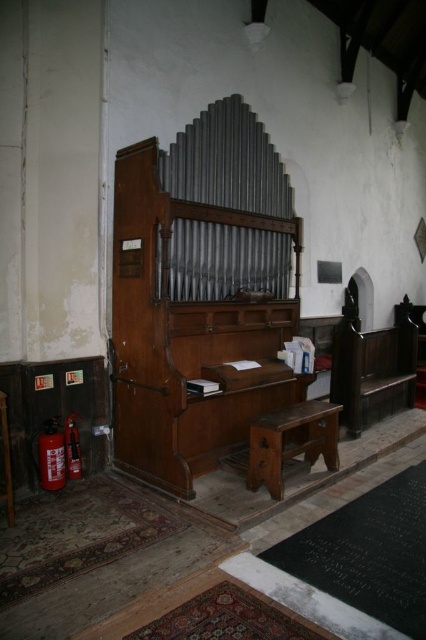
Looking at this image, which of these two, brown wooden bench at center or red matte extinguisher at lower left, stands taller?

Standing taller between the two is brown wooden bench at center.

Who is positioned more to the left, brown wooden bench at center or red matte extinguisher at lower left?

From the viewer's perspective, red matte extinguisher at lower left appears more on the left side.

Does point (294, 422) come closer to viewer compared to point (77, 438)?

Yes, point (294, 422) is closer to viewer.

Locate an element on the screen. The image size is (426, 640). brown wooden bench at center is located at coordinates (291, 442).

Does point (279, 461) come closer to viewer compared to point (40, 454)?

Yes, point (279, 461) is in front of point (40, 454).

Find the location of a particular element. This screenshot has width=426, height=640. brown wooden bench at center is located at coordinates (291, 442).

Which of these two, red matte fire extinguisher at lower left or red matte extinguisher at lower left, stands taller?

red matte fire extinguisher at lower left

In the scene shown: Who is positioned more to the left, red matte fire extinguisher at lower left or red matte extinguisher at lower left?

red matte fire extinguisher at lower left is more to the left.

Identify the location of red matte fire extinguisher at lower left. (51, 456).